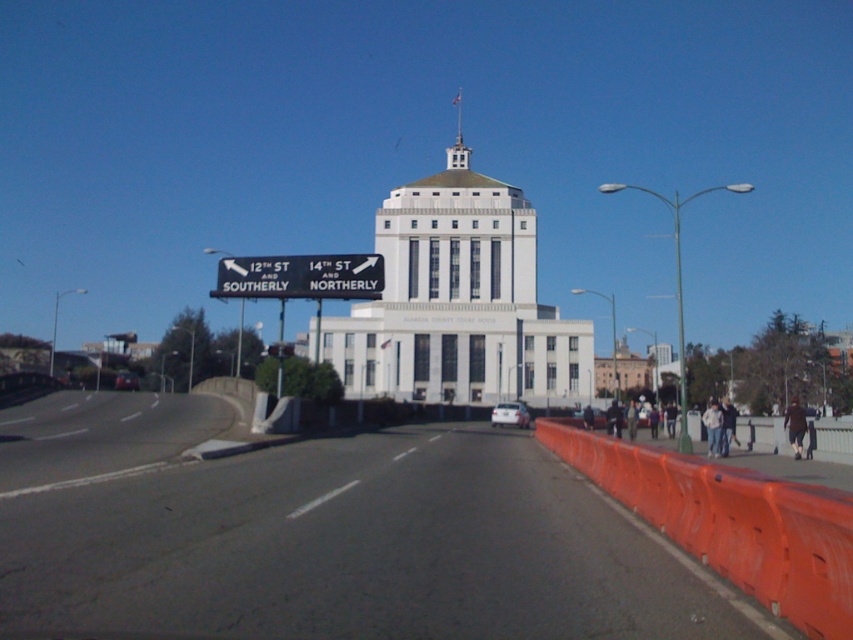
Question: Considering the real-world distances, which object is closest to the black plastic sign at upper center?

Choices:
 (A) white matte car at center
 (B) orange plastic barricade at right

Answer: (B)

Question: Is black plastic sign at upper center bigger than shiny red car at center?

Choices:
 (A) no
 (B) yes

Answer: (A)

Question: Does orange plastic barricade at right have a larger size compared to black plastic sign at upper center?

Choices:
 (A) no
 (B) yes

Answer: (B)

Question: Is orange plastic barricade at right wider than shiny red car at center?

Choices:
 (A) yes
 (B) no

Answer: (B)

Question: Which object appears closest to the camera in this image?

Choices:
 (A) white concrete building at center
 (B) white matte car at center

Answer: (A)

Question: Considering the real-world distances, which object is farthest from the orange plastic barricade at right?

Choices:
 (A) shiny red car at center
 (B) white matte car at center

Answer: (A)